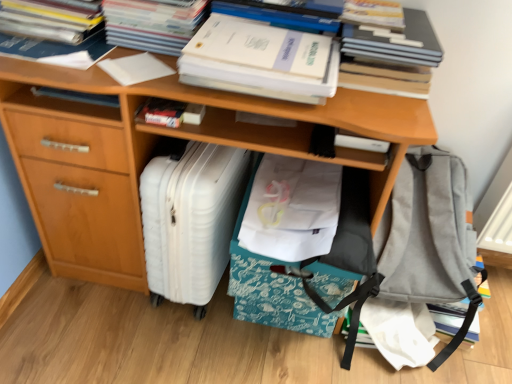
In order to click on vacant space situated above white paper at upper left, which appears as the sixth book when viewed from the right (from a real-world perspective) in this screenshot , I will do tap(50, 45).